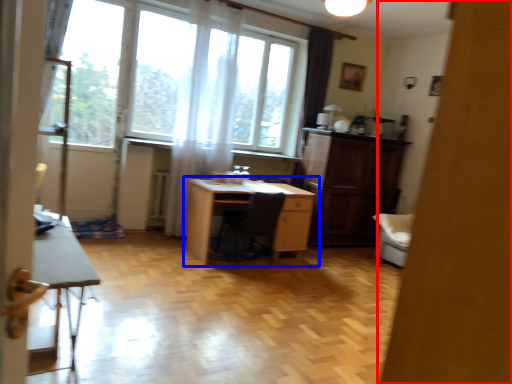
Question: Among these objects, which one is farthest to the camera, screen door (highlighted by a red box) or desk (highlighted by a blue box)?

Choices:
 (A) screen door
 (B) desk

Answer: (B)